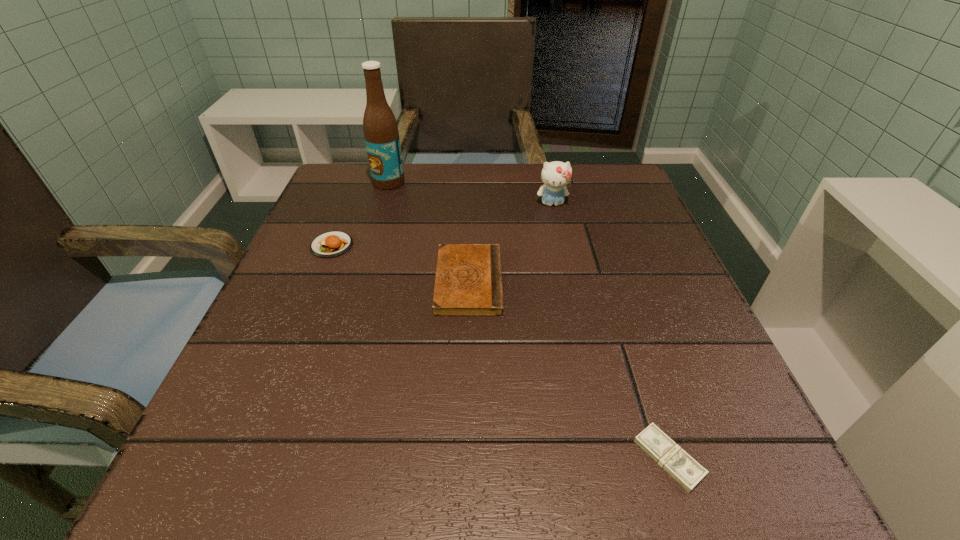
This screenshot has height=540, width=960. I want to click on empty space between the third shortest object and the kitten, so click(442, 225).

Where is `empty location between the fourth nearest object and the beer bottle`? This screenshot has width=960, height=540. empty location between the fourth nearest object and the beer bottle is located at coordinates (470, 193).

The height and width of the screenshot is (540, 960). I want to click on free space between the tallest object and the second farthest object, so click(x=470, y=193).

Identify the location of free space between the fourth shortest object and the shortest object. The width and height of the screenshot is (960, 540). coord(611,331).

Find the location of a particular element. This screenshot has height=540, width=960. free space between the farthest object and the fourth tallest object is located at coordinates (429, 232).

Identify the location of vacant area between the kitten and the farthest object. This screenshot has height=540, width=960. (470, 193).

This screenshot has width=960, height=540. I want to click on vacant area that lies between the rightmost object and the kitten, so click(x=611, y=331).

You are a GUI agent. You are given a task and a screenshot of the screen. Output one action in this format:
    pyautogui.click(x=<x>, y=<y>)
    Task: Click on the empty space that is in between the third object from left to right and the rightmost object
    This screenshot has height=540, width=960.
    Given the screenshot: What is the action you would take?
    pyautogui.click(x=568, y=370)

Image resolution: width=960 pixels, height=540 pixels. What are the coordinates of `object that stands as the second closest to the third shortest object` in the screenshot? It's located at (468, 282).

Locate which object ranks fourth in proximity to the rightmost object. Please provide its 2D coordinates. Your answer should be formatted as a tuple, i.e. [(x, y)], where the tuple contains the x and y coordinates of a point satisfying the conditions above.

[(380, 128)]